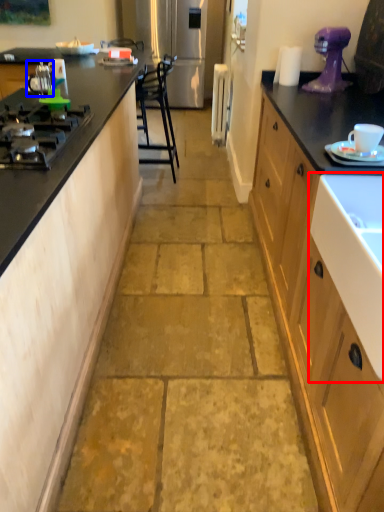
Question: Among these objects, which one is nearest to the camera, sink (highlighted by a red box) or appliance (highlighted by a blue box)?

Choices:
 (A) sink
 (B) appliance

Answer: (A)